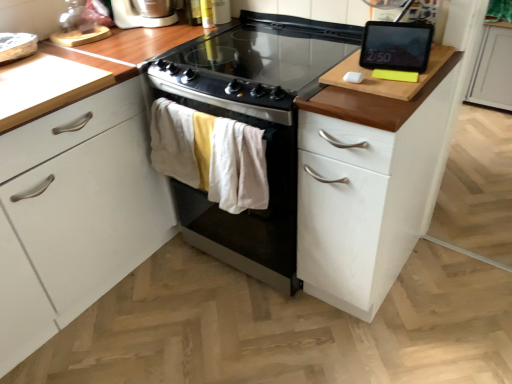
Question: Is black glossy tablet at upper right outside of white plastic toaster at upper left?

Choices:
 (A) yes
 (B) no

Answer: (A)

Question: Is black glossy tablet at upper right taller than white plastic toaster at upper left?

Choices:
 (A) no
 (B) yes

Answer: (A)

Question: Can you confirm if black glossy tablet at upper right is thinner than white plastic toaster at upper left?

Choices:
 (A) no
 (B) yes

Answer: (B)

Question: Does black glossy tablet at upper right have a larger size compared to white plastic toaster at upper left?

Choices:
 (A) yes
 (B) no

Answer: (B)

Question: Is black glossy tablet at upper right surrounding white plastic toaster at upper left?

Choices:
 (A) yes
 (B) no

Answer: (B)

Question: Is black glossy tablet at upper right to the left or to the right of black glass-top oven at center in the image?

Choices:
 (A) left
 (B) right

Answer: (B)

Question: Is black glossy tablet at upper right bigger or smaller than black glass-top oven at center?

Choices:
 (A) small
 (B) big

Answer: (A)

Question: From a real-world perspective, is black glossy tablet at upper right positioned above or below black glass-top oven at center?

Choices:
 (A) below
 (B) above

Answer: (B)

Question: In the image, is black glossy tablet at upper right positioned in front of or behind black glass-top oven at center?

Choices:
 (A) behind
 (B) front

Answer: (B)

Question: Is point (126, 21) positioned closer to the camera than point (316, 59)?

Choices:
 (A) farther
 (B) closer

Answer: (A)

Question: From the image's perspective, is white plastic toaster at upper left above or below black glass-top oven at center?

Choices:
 (A) below
 (B) above

Answer: (B)

Question: Choose the correct answer: Is white plastic toaster at upper left inside black glass-top oven at center or outside it?

Choices:
 (A) outside
 (B) inside

Answer: (A)

Question: In the image, is white plastic toaster at upper left on the left side or the right side of black glass-top oven at center?

Choices:
 (A) right
 (B) left

Answer: (B)

Question: From the image's perspective, is black glass cooktop at center positioned above or below black glossy tablet at upper right?

Choices:
 (A) above
 (B) below

Answer: (A)

Question: Is black glass cooktop at center taller or shorter than black glossy tablet at upper right?

Choices:
 (A) short
 (B) tall

Answer: (A)